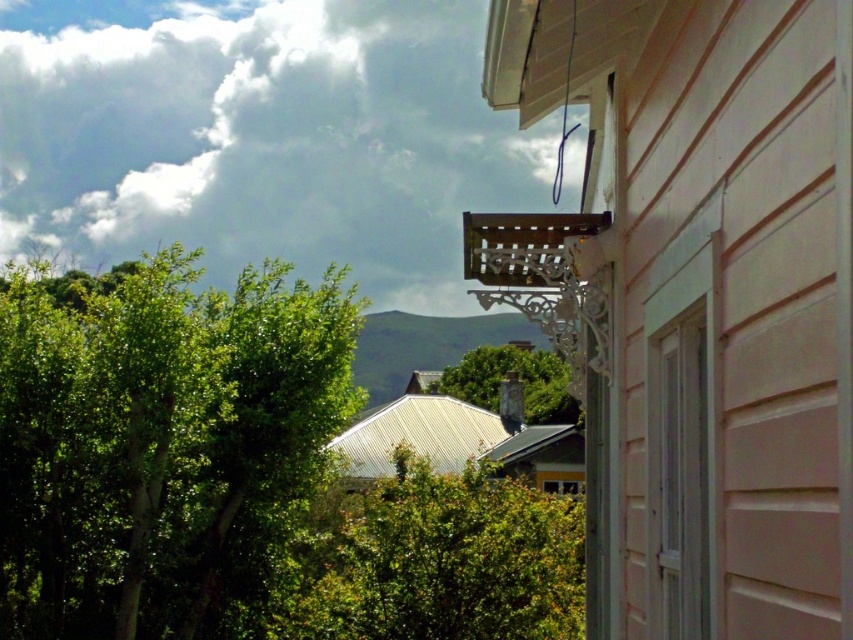
Between pink painted wood siding at right and green leafy tree at left, which one is positioned higher?

green leafy tree at left is higher up.

Locate an element on the screen. pink painted wood siding at right is located at coordinates (709, 301).

Which is in front, point (848, 173) or point (172, 365)?

Positioned in front is point (848, 173).

Identify the location of pink painted wood siding at right. Image resolution: width=853 pixels, height=640 pixels. (709, 301).

Does point (537, 541) come farther from viewer compared to point (656, 493)?

Yes, it is.

Between green leafy bush at center and white painted wood window at right, which one is positioned lower?

green leafy bush at center

The width and height of the screenshot is (853, 640). I want to click on green leafy bush at center, so click(x=438, y=561).

Is point (755, 472) closer to viewer compared to point (514, 365)?

That is True.

Which is in front, point (772, 609) or point (523, 356)?

Point (772, 609) is in front.

You are a GUI agent. You are given a task and a screenshot of the screen. Output one action in this format:
    pyautogui.click(x=<x>, y=<y>)
    Task: Click on the pink painted wood siding at right
    The height and width of the screenshot is (640, 853).
    Given the screenshot: What is the action you would take?
    pyautogui.click(x=709, y=301)